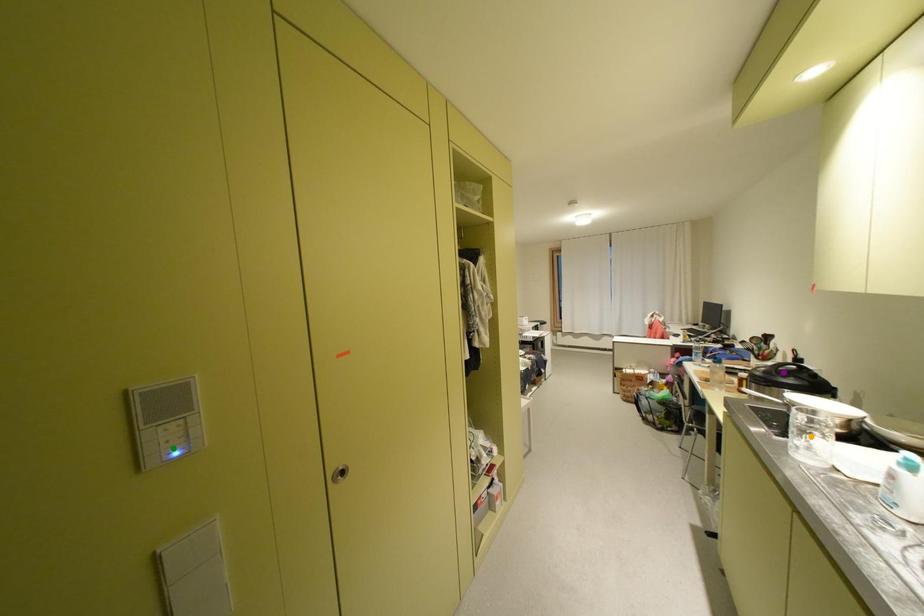
Order these from nearest to farthest:
green point, orange point, purple point

purple point → orange point → green point